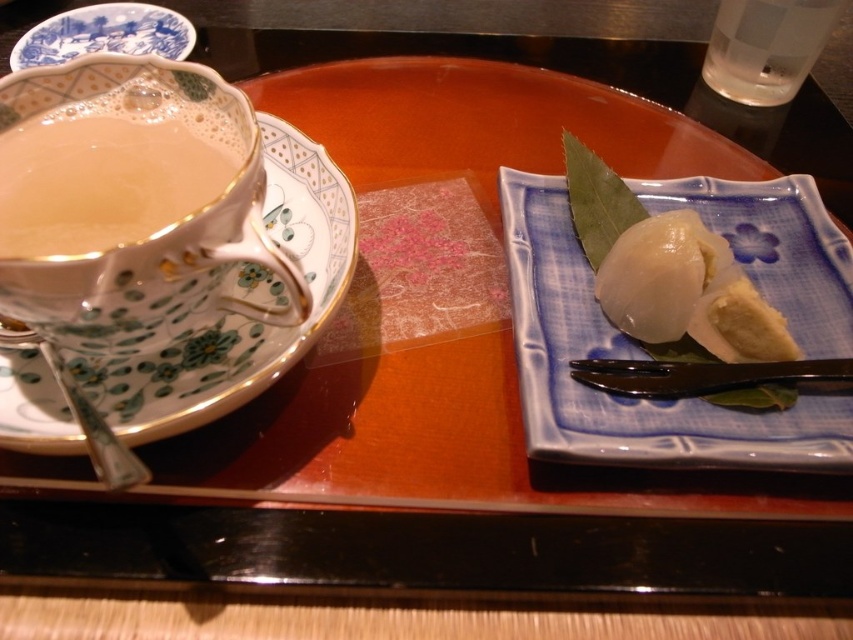
Question: Can you confirm if translucent porcelain cup at left is positioned to the right of blue porcelain plate at upper left?

Choices:
 (A) no
 (B) yes

Answer: (B)

Question: Is transparent glass at upper right to the left of blue porcelain plate at upper left from the viewer's perspective?

Choices:
 (A) yes
 (B) no

Answer: (B)

Question: Which object is closer to the camera taking this photo?

Choices:
 (A) white porcelain dumplings at center
 (B) blue porcelain plate at upper left
 (C) transparent glass at upper right

Answer: (A)

Question: Among these points, which one is nearest to the camera?

Choices:
 (A) (119, 417)
 (B) (788, 189)
 (C) (57, 236)

Answer: (C)

Question: Which point is closer to the camera?

Choices:
 (A) [x=138, y=49]
 (B) [x=102, y=134]
 (C) [x=785, y=280]

Answer: (B)

Question: Does white porcelain dumplings at center appear on the right side of transparent glass at upper right?

Choices:
 (A) yes
 (B) no

Answer: (B)